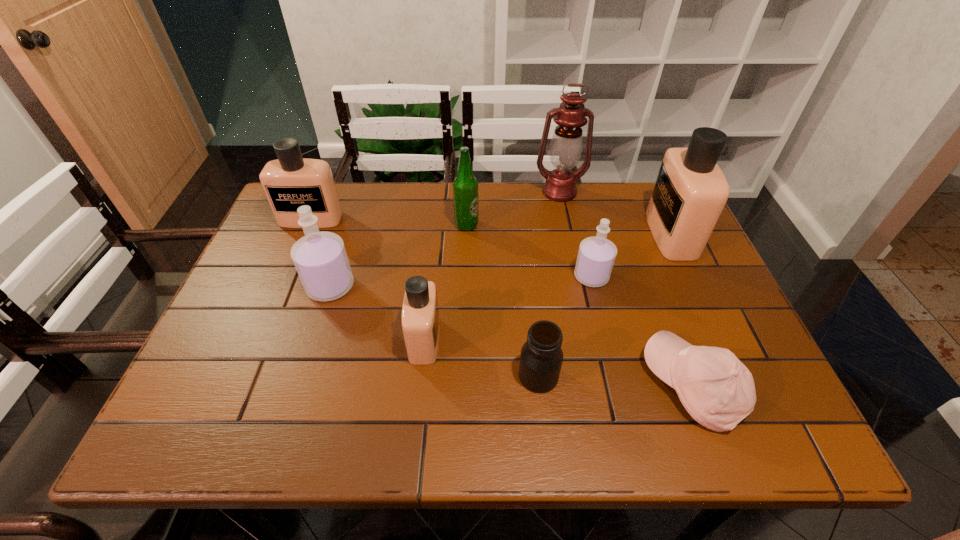
Identify the location of beer bottle located in the far edge section of the desktop. (465, 186).

Where is `object positioned at the near edge`? This screenshot has width=960, height=540. object positioned at the near edge is located at coordinates (718, 391).

At what (x,y) coordinates should I click in order to perform the action: click on object at the left edge. Please return your answer as a coordinate pair (x, y). This screenshot has height=540, width=960. Looking at the image, I should click on (291, 181).

The height and width of the screenshot is (540, 960). Identify the location of perfume at the right edge. (690, 192).

Where is `baseball cap at the right edge`? Image resolution: width=960 pixels, height=540 pixels. baseball cap at the right edge is located at coordinates (718, 391).

This screenshot has height=540, width=960. Find the location of `object that is at the far left corner`. object that is at the far left corner is located at coordinates (291, 181).

At what (x,y) coordinates should I click in order to perform the action: click on object at the far right corner. Please return your answer as a coordinate pair (x, y). The width and height of the screenshot is (960, 540). Looking at the image, I should click on (690, 192).

Identify the location of object at the near right corner. Image resolution: width=960 pixels, height=540 pixels. (718, 391).

In the image, there is a desktop. Identify the location of blank space at the far edge. The width and height of the screenshot is (960, 540). (523, 212).

This screenshot has height=540, width=960. Identify the location of free location at the left edge of the desktop. (219, 384).